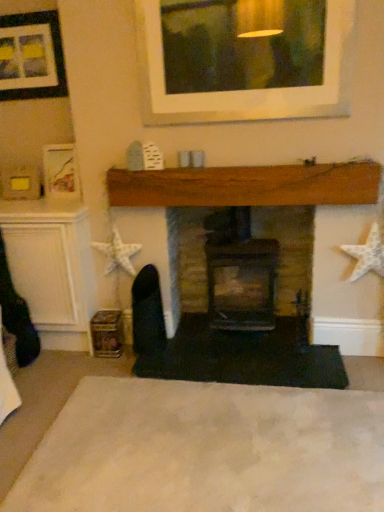
Question: In the image, is white soft carpet at lower center positioned in front of or behind wooden fireplace at center, arranged as the second fireplace when viewed from the right?

Choices:
 (A) behind
 (B) front

Answer: (B)

Question: From the image's perspective, is white soft carpet at lower center above or below wooden fireplace at center, which is the 1th fireplace in left-to-right order?

Choices:
 (A) above
 (B) below

Answer: (B)

Question: Which object is the closest to the wooden fireplace at center, which is the 1th fireplace in left-to-right order?

Choices:
 (A) white soft carpet at lower center
 (B) matte black picture frame at upper left
 (C) brick fireplace at center, placed as the second fireplace when sorted from left to right

Answer: (C)

Question: Estimate the real-world distances between objects in this image. Which object is farther from the wooden fireplace at center, which is the 1th fireplace in left-to-right order?

Choices:
 (A) matte black picture frame at upper left
 (B) white soft carpet at lower center
 (C) brick fireplace at center, placed as the second fireplace when sorted from left to right

Answer: (A)